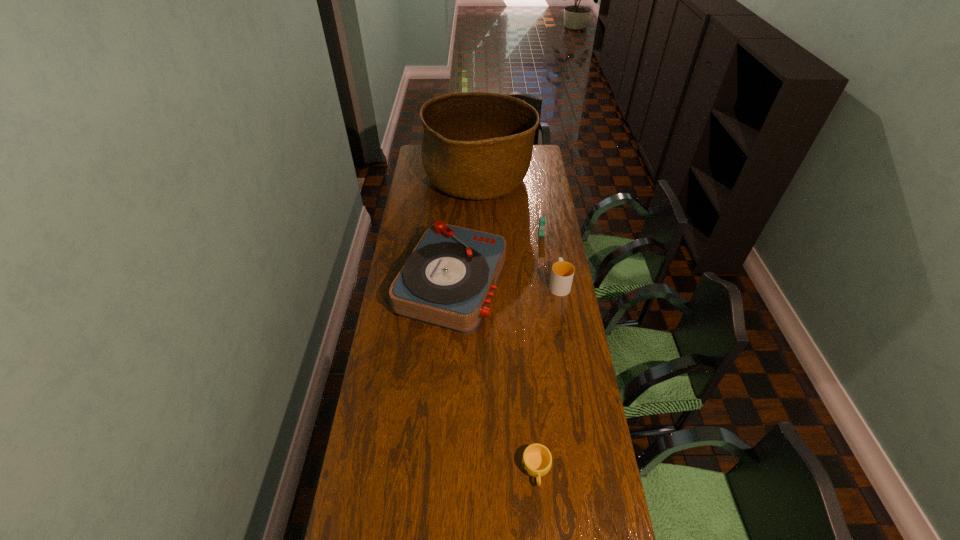
Locate an element on the screen. object that is at the far left corner is located at coordinates [x=476, y=145].

Identify the location of object that is at the far right corner. The width and height of the screenshot is (960, 540). (476, 145).

Identify the location of free space at the left edge of the desktop. The height and width of the screenshot is (540, 960). (420, 198).

Locate an element on the screen. vacant space at the right edge is located at coordinates (539, 194).

At what (x,y) coordinates should I click in order to perform the action: click on unoccupied area between the second farthest object and the nearer cup. Please return your answer as a coordinate pair (x, y). Looking at the image, I should click on (539, 352).

Find the location of a particular element. This screenshot has height=540, width=960. empty location between the nearest object and the tallest object is located at coordinates (507, 324).

Image resolution: width=960 pixels, height=540 pixels. In order to click on blank region between the second farthest object and the farthest object in this screenshot , I will do `click(510, 206)`.

At what (x,y) coordinates should I click in order to perform the action: click on vacant space that is in between the right cup and the shortest object. Please return your answer as a coordinate pair (x, y). This screenshot has width=960, height=540. Looking at the image, I should click on (548, 376).

Choose which object is the fourth nearest neighbor to the record player. Please provide its 2D coordinates. Your answer should be formatted as a tuple, i.e. [(x, y)], where the tuple contains the x and y coordinates of a point satisfying the conditions above.

[(536, 460)]

Where is `object that is the third nearest to the basket`? object that is the third nearest to the basket is located at coordinates (562, 273).